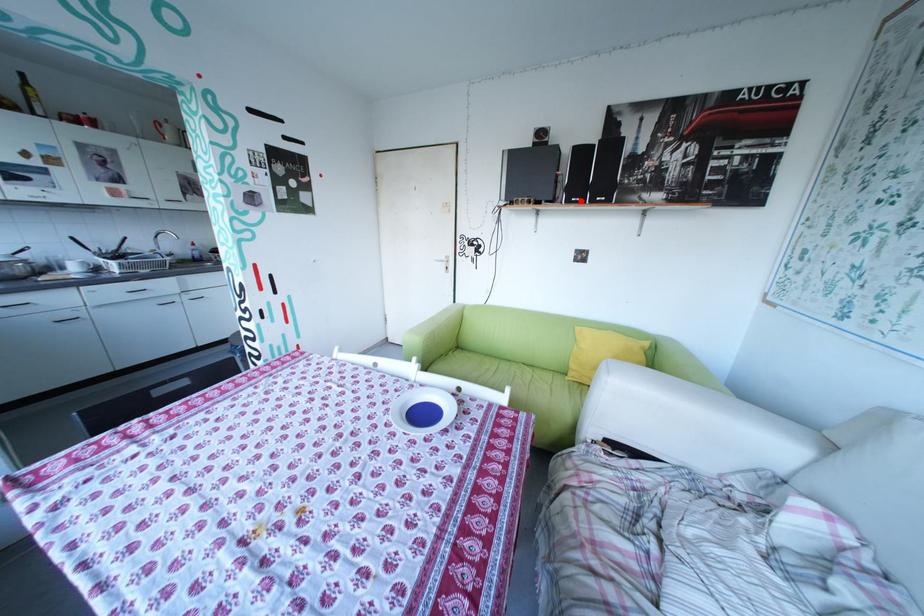
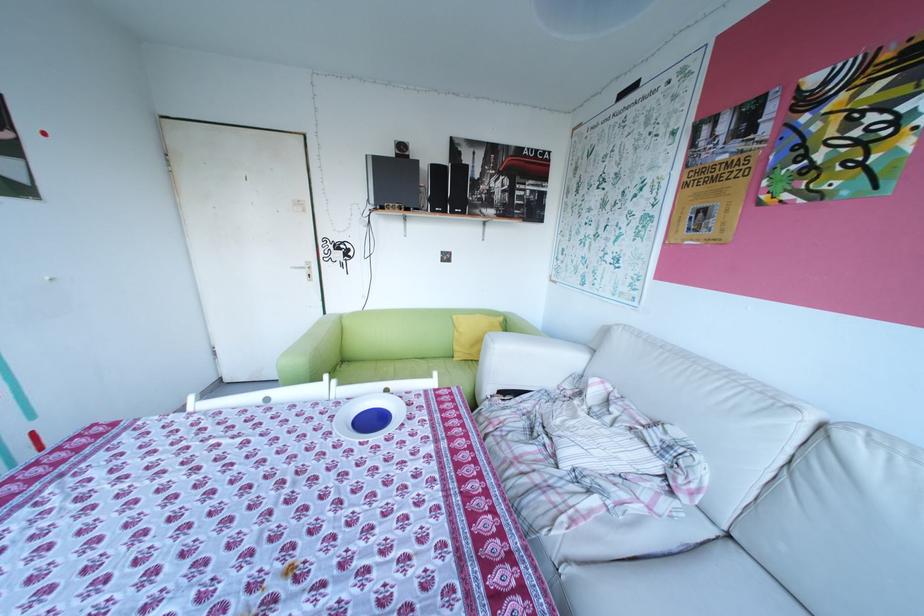
In the second image, find the point that corresponds to the highlighted location in the first image.

(445, 209)